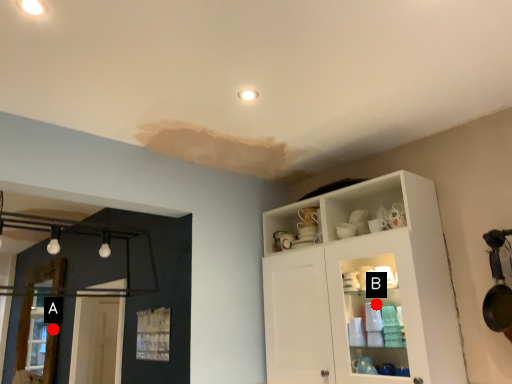
Question: Two points are circled on the image, labeled by A and B beside each circle. Which point is farther from the camera taking this photo?

Choices:
 (A) A is further
 (B) B is further

Answer: (A)